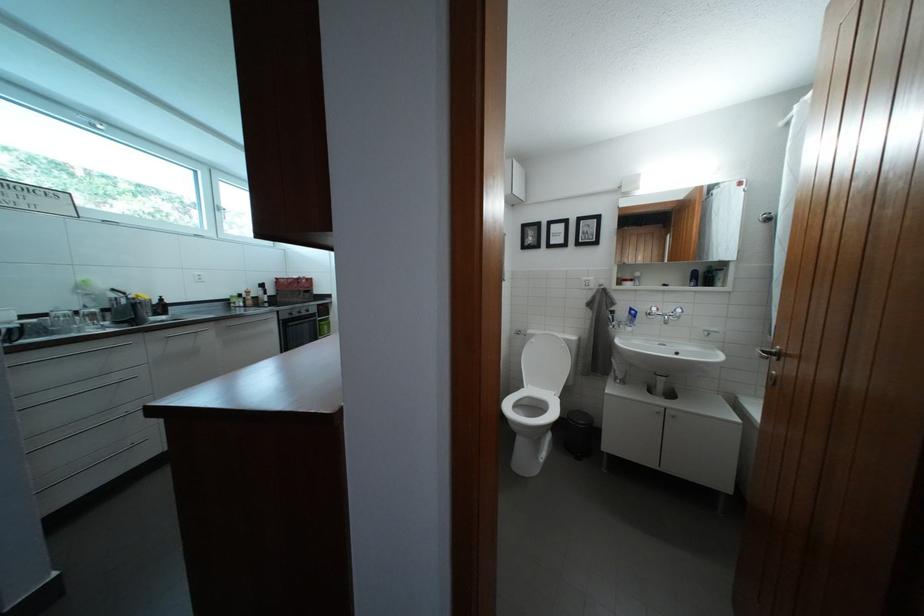
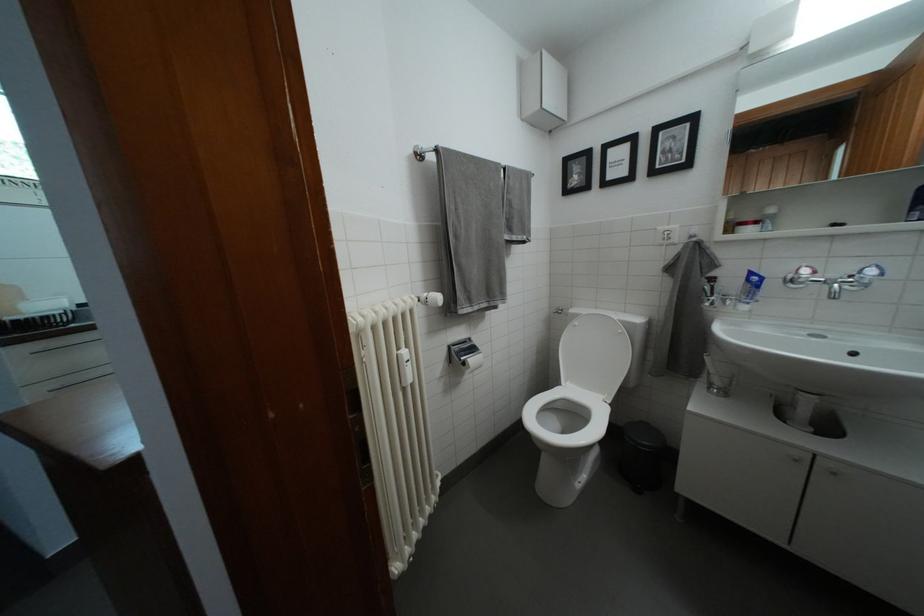
The point at (622, 379) is marked in the first image. Where is the corresponding point in the second image?

(714, 382)